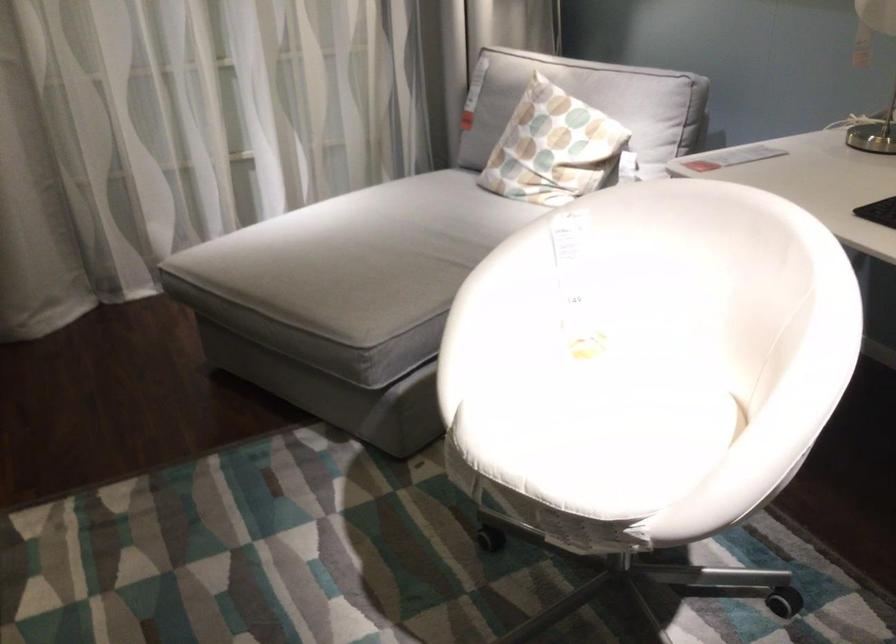
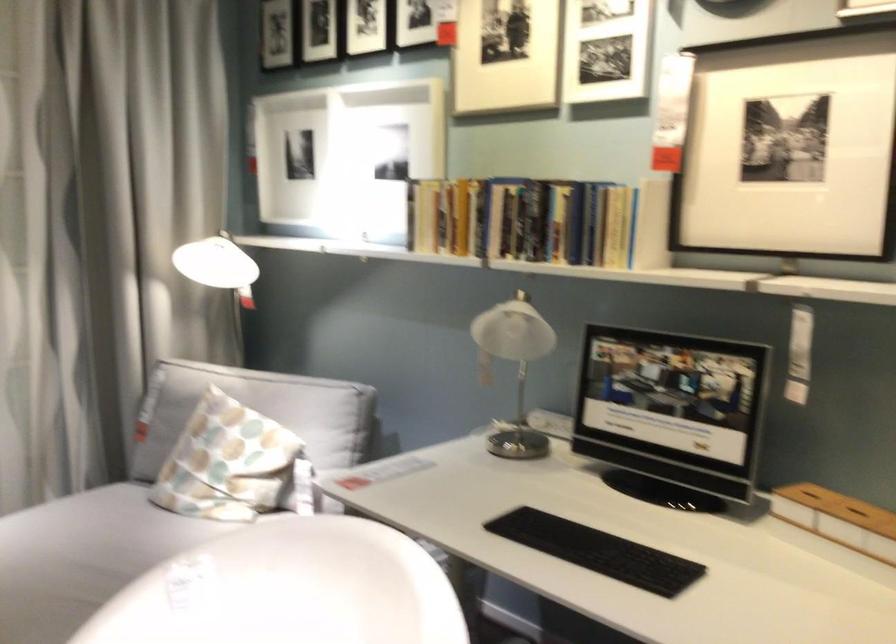
The images are taken continuously from a first-person perspective. In which direction is your viewpoint rotating?

The camera's rotation is toward right-up.